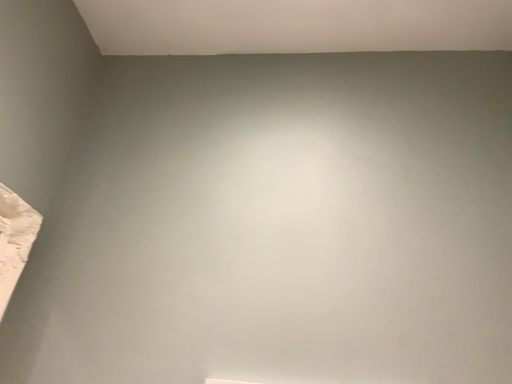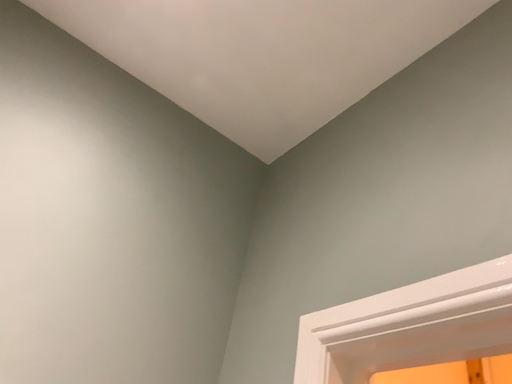
Question: How did the camera likely rotate when shooting the video?

Choices:
 (A) rotated downward
 (B) rotated upward

Answer: (A)